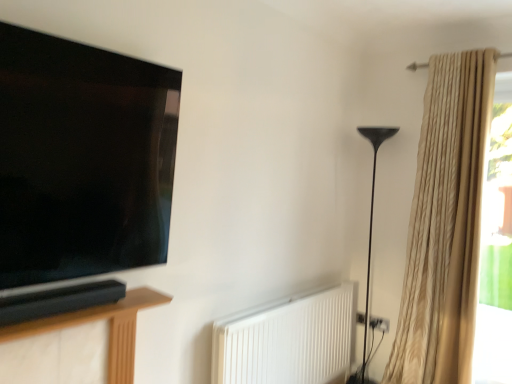
Question: From a real-world perspective, does black metal floor lamp at right stand above matte black tv at left?

Choices:
 (A) yes
 (B) no

Answer: (B)

Question: Is black metal floor lamp at right closer to the viewer compared to matte black tv at left?

Choices:
 (A) yes
 (B) no

Answer: (B)

Question: Is black metal floor lamp at right further to the viewer compared to matte black tv at left?

Choices:
 (A) yes
 (B) no

Answer: (A)

Question: Is black metal floor lamp at right positioned with its back to matte black tv at left?

Choices:
 (A) no
 (B) yes

Answer: (A)

Question: Does black metal floor lamp at right have a lesser height compared to matte black tv at left?

Choices:
 (A) yes
 (B) no

Answer: (B)

Question: Considering the positions of translucent glass window at right and beige textured curtain at right in the image, is translucent glass window at right wider or thinner than beige textured curtain at right?

Choices:
 (A) wide
 (B) thin

Answer: (B)

Question: Considering the positions of point (497, 261) and point (470, 307), is point (497, 261) closer or farther from the camera than point (470, 307)?

Choices:
 (A) closer
 (B) farther

Answer: (B)

Question: Is translucent glass window at right in front of or behind beige textured curtain at right in the image?

Choices:
 (A) front
 (B) behind

Answer: (B)

Question: From their relative heights in the image, would you say translucent glass window at right is taller or shorter than beige textured curtain at right?

Choices:
 (A) short
 (B) tall

Answer: (A)

Question: In terms of height, does matte black tv at left look taller or shorter compared to beige textured curtain at right?

Choices:
 (A) short
 (B) tall

Answer: (A)

Question: From the image's perspective, is matte black tv at left above or below beige textured curtain at right?

Choices:
 (A) above
 (B) below

Answer: (A)

Question: Relative to beige textured curtain at right, is matte black tv at left in front or behind?

Choices:
 (A) front
 (B) behind

Answer: (A)

Question: Is point tap(73, 49) positioned closer to the camera than point tap(430, 243)?

Choices:
 (A) closer
 (B) farther

Answer: (A)

Question: Considering the positions of point (373, 205) and point (40, 49), is point (373, 205) closer or farther from the camera than point (40, 49)?

Choices:
 (A) farther
 (B) closer

Answer: (A)

Question: From a real-world perspective, is black metal floor lamp at right positioned above or below matte black tv at left?

Choices:
 (A) below
 (B) above

Answer: (A)